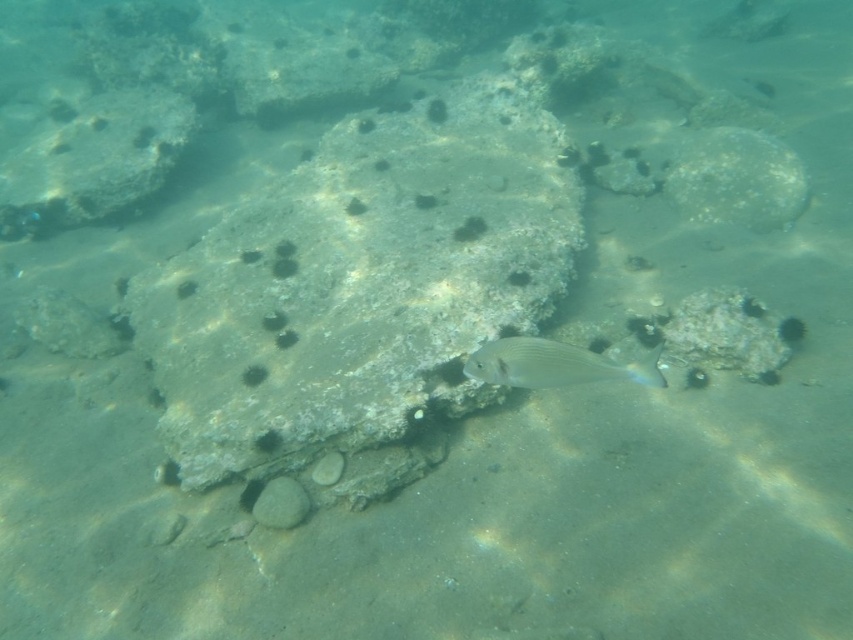
Is point (328, 333) farther from viewer compared to point (554, 365)?

Yes, point (328, 333) is farther from viewer.

Is gray rock at center to the right of silvery metallic fish at center from the viewer's perspective?

Incorrect, gray rock at center is not on the right side of silvery metallic fish at center.

Is point (498, 115) positioned behind point (479, 380)?

Yes, it is behind point (479, 380).

Image resolution: width=853 pixels, height=640 pixels. What are the coordinates of `gray rock at center` in the screenshot? It's located at (361, 284).

Is smooth gray rock at upper right taller than silvery metallic fish at center?

Yes, smooth gray rock at upper right is taller than silvery metallic fish at center.

Does smooth gray rock at upper right have a greater width compared to silvery metallic fish at center?

Yes.

Is point (764, 202) in front of point (543, 340)?

That is False.

The image size is (853, 640). I want to click on smooth gray rock at upper right, so click(x=735, y=179).

Is gray rock at center further to camera compared to smooth gray rock at upper right?

No, gray rock at center is closer to the viewer.

Does gray rock at center have a lesser height compared to smooth gray rock at upper right?

Incorrect, gray rock at center's height does not fall short of smooth gray rock at upper right's.

Is point (403, 116) more distant than point (758, 172)?

Yes, it is behind point (758, 172).

This screenshot has height=640, width=853. I want to click on gray rock at center, so click(361, 284).